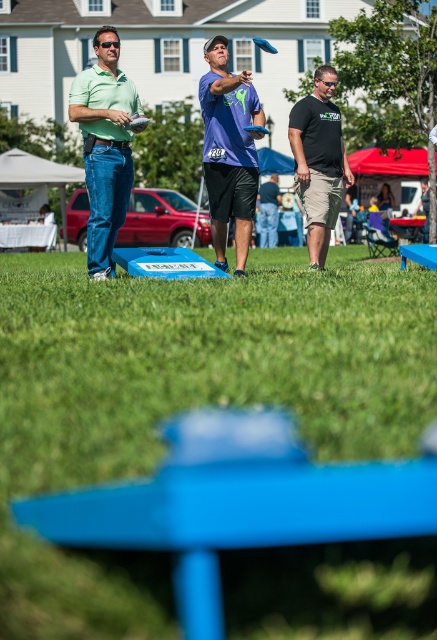
Image resolution: width=437 pixels, height=640 pixels. What do you see at coordinates (319, 161) in the screenshot?
I see `black matte t-shirt at center` at bounding box center [319, 161].

Who is more forward, (321, 88) or (273, 177)?

Point (321, 88) is in front.

Which is behind, point (319, 179) or point (267, 198)?

The point (267, 198) is more distant.

At what (x,y) coordinates should I click in order to perform the action: click on black matte t-shirt at center. Please return your answer as a coordinate pair (x, y). Image resolution: width=437 pixels, height=640 pixels. Looking at the image, I should click on (319, 161).

Is green grass at center below purple matte t-shirt at center?

Yes, green grass at center is below purple matte t-shirt at center.

Does green grass at center appear over purple matte t-shirt at center?

No, green grass at center is not above purple matte t-shirt at center.

Is point (249, 339) closer to camera compared to point (249, 212)?

Yes, point (249, 339) is in front of point (249, 212).

Where is `green grass at center`? This screenshot has width=437, height=640. green grass at center is located at coordinates (186, 400).

Is matte green shirt at left to the right of blue fabric shorts at center from the viewer's perspective?

No, matte green shirt at left is not to the right of blue fabric shorts at center.

Does matte green shirt at left appear over blue fabric shorts at center?

No.

Is point (73, 118) positioned behind point (267, 182)?

No, it is in front of (267, 182).

Where is `matte green shirt at left`? matte green shirt at left is located at coordinates (104, 147).